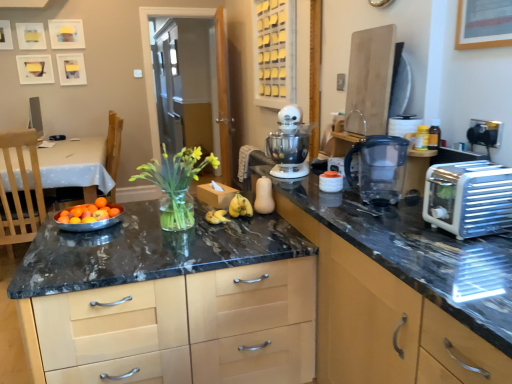
Question: Does yellow matte bananas at center have a larger size compared to white plastic toaster at right?

Choices:
 (A) no
 (B) yes

Answer: (A)

Question: Is yellow matte bananas at center positioned beyond the bounds of white plastic toaster at right?

Choices:
 (A) yes
 (B) no

Answer: (A)

Question: Considering the relative sizes of yellow matte bananas at center and white plastic toaster at right in the image provided, is yellow matte bananas at center taller than white plastic toaster at right?

Choices:
 (A) no
 (B) yes

Answer: (A)

Question: From a real-world perspective, is yellow matte bananas at center under white plastic toaster at right?

Choices:
 (A) no
 (B) yes

Answer: (B)

Question: Considering the relative positions of yellow matte bananas at center and white plastic toaster at right in the image provided, is yellow matte bananas at center to the left of white plastic toaster at right from the viewer's perspective?

Choices:
 (A) yes
 (B) no

Answer: (A)

Question: Considering the positions of matte black countertop at center, positioned as the 3th cabinetry in top-to-bottom order, and wooden chair at left in the image, is matte black countertop at center, positioned as the 3th cabinetry in top-to-bottom order, wider or thinner than wooden chair at left?

Choices:
 (A) wide
 (B) thin

Answer: (A)

Question: Is matte black countertop at center, positioned as the 3th cabinetry in top-to-bottom order, taller or shorter than wooden chair at left?

Choices:
 (A) tall
 (B) short

Answer: (B)

Question: From a real-world perspective, is matte black countertop at center, which is the first cabinetry in bottom-to-top order, positioned above or below wooden chair at left?

Choices:
 (A) above
 (B) below

Answer: (B)

Question: In the image, is matte black countertop at center, positioned as the 3th cabinetry in top-to-bottom order, positioned in front of or behind wooden chair at left?

Choices:
 (A) behind
 (B) front

Answer: (B)

Question: From a real-world perspective, is white plastic toaster at right physically located above or below white plastic stand mixer at center?

Choices:
 (A) below
 (B) above

Answer: (A)

Question: Based on their sizes in the image, would you say white plastic toaster at right is bigger or smaller than white plastic stand mixer at center?

Choices:
 (A) big
 (B) small

Answer: (B)

Question: From the image's perspective, is white plastic toaster at right above or below white plastic stand mixer at center?

Choices:
 (A) above
 (B) below

Answer: (B)

Question: Is point click(490, 218) positioned closer to the camera than point click(306, 144)?

Choices:
 (A) closer
 (B) farther

Answer: (A)

Question: Does point (273, 1) appear closer or farther from the camera than point (293, 135)?

Choices:
 (A) farther
 (B) closer

Answer: (A)

Question: Visually, is matte wood cabinet at upper center, acting as the 3th cabinetry starting from the bottom, positioned to the left or to the right of white plastic stand mixer at center?

Choices:
 (A) right
 (B) left

Answer: (B)